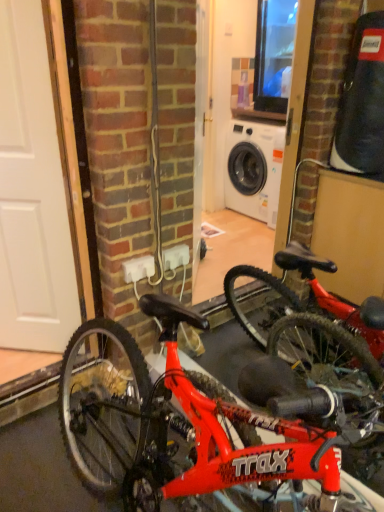
Question: Does white plastic electric outlet at center appear on the right side of white matte door at left?

Choices:
 (A) no
 (B) yes

Answer: (B)

Question: From the image's perspective, is white plastic electric outlet at center below white matte door at left?

Choices:
 (A) yes
 (B) no

Answer: (A)

Question: Could you tell me if white plastic electric outlet at center is turned towards white matte door at left?

Choices:
 (A) yes
 (B) no

Answer: (B)

Question: Considering the relative sizes of white plastic electric outlet at center and white matte door at left in the image provided, is white plastic electric outlet at center shorter than white matte door at left?

Choices:
 (A) yes
 (B) no

Answer: (A)

Question: Can you confirm if white plastic electric outlet at center is taller than white matte door at left?

Choices:
 (A) no
 (B) yes

Answer: (A)

Question: Are white plastic electric outlet at center and white matte door at left located far from each other?

Choices:
 (A) yes
 (B) no

Answer: (B)

Question: Is white matte door at left further to the viewer compared to shiny red bicycle at center?

Choices:
 (A) no
 (B) yes

Answer: (B)

Question: Is white matte door at left at the right side of shiny red bicycle at center?

Choices:
 (A) no
 (B) yes

Answer: (A)

Question: From a real-world perspective, is white matte door at left on top of shiny red bicycle at center?

Choices:
 (A) yes
 (B) no

Answer: (A)

Question: Would you say shiny red bicycle at center is part of white matte door at left's contents?

Choices:
 (A) yes
 (B) no

Answer: (B)

Question: Could you tell me if white matte door at left is turned towards shiny red bicycle at center?

Choices:
 (A) yes
 (B) no

Answer: (B)

Question: Is white matte door at left oriented away from shiny red bicycle at center?

Choices:
 (A) yes
 (B) no

Answer: (B)

Question: From a real-world perspective, does white plastic electric outlet at center sit lower than shiny red bicycle at center?

Choices:
 (A) no
 (B) yes

Answer: (A)